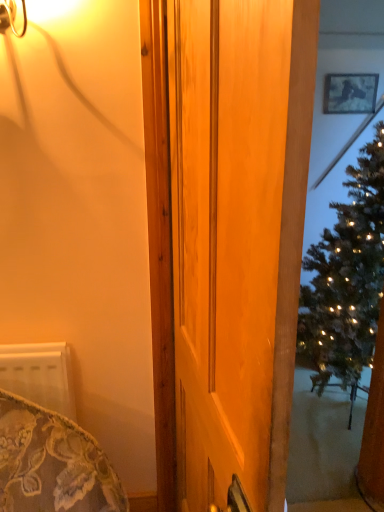
Question: Considering the relative positions of wooden door at center and metallic silver picture frame at upper right in the image provided, is wooden door at center to the left or to the right of metallic silver picture frame at upper right?

Choices:
 (A) right
 (B) left

Answer: (B)

Question: Is point (251, 468) positioned closer to the camera than point (370, 100)?

Choices:
 (A) closer
 (B) farther

Answer: (A)

Question: From their relative heights in the image, would you say wooden door at center is taller or shorter than metallic silver picture frame at upper right?

Choices:
 (A) tall
 (B) short

Answer: (A)

Question: From a real-world perspective, is metallic silver picture frame at upper right positioned above or below wooden door at center?

Choices:
 (A) above
 (B) below

Answer: (A)

Question: Is point (345, 96) positioned closer to the camera than point (261, 76)?

Choices:
 (A) closer
 (B) farther

Answer: (B)

Question: Relative to wooden door at center, is metallic silver picture frame at upper right in front or behind?

Choices:
 (A) behind
 (B) front

Answer: (A)

Question: Is metallic silver picture frame at upper right taller or shorter than wooden door at center?

Choices:
 (A) short
 (B) tall

Answer: (A)